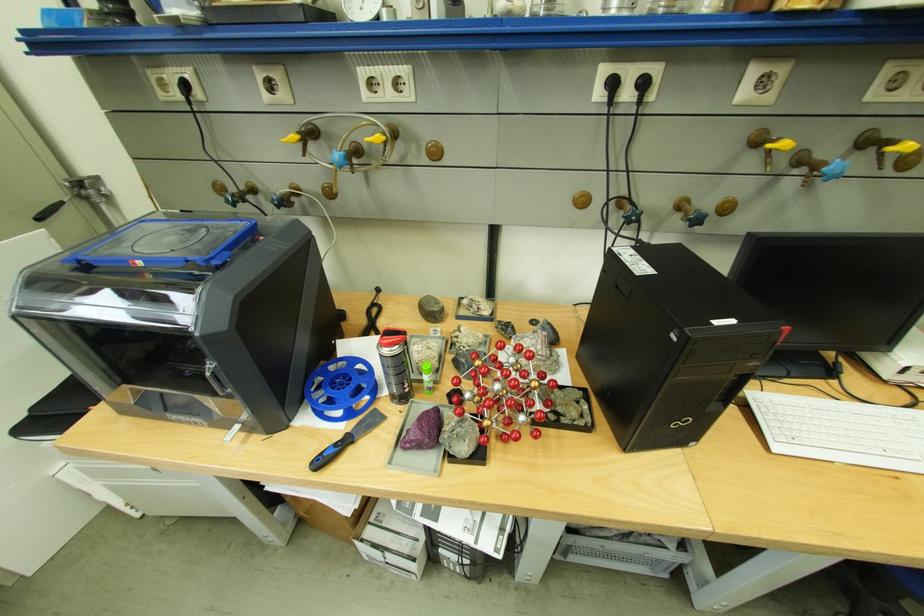
At what (x,y) coordinates should I click in order to perform the action: click on machine's transparent cover. Please return your answer as a coordinate pair (x, y). The width and height of the screenshot is (924, 616). Looking at the image, I should click on (165, 246).